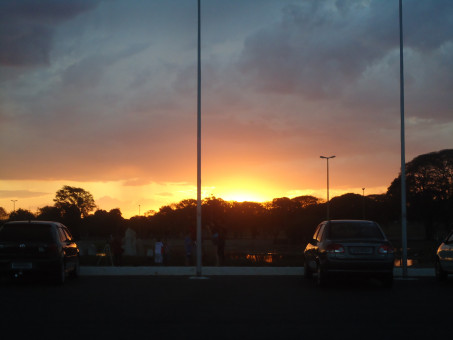
You are a GUI agent. You are given a task and a screenshot of the screen. Output one action in this format:
    pyautogui.click(x=<x>, y=<y>)
    Task: Click on the light bulb
    
    Given the screenshot: What is the action you would take?
    pyautogui.click(x=322, y=156), pyautogui.click(x=334, y=156), pyautogui.click(x=16, y=201), pyautogui.click(x=11, y=201)